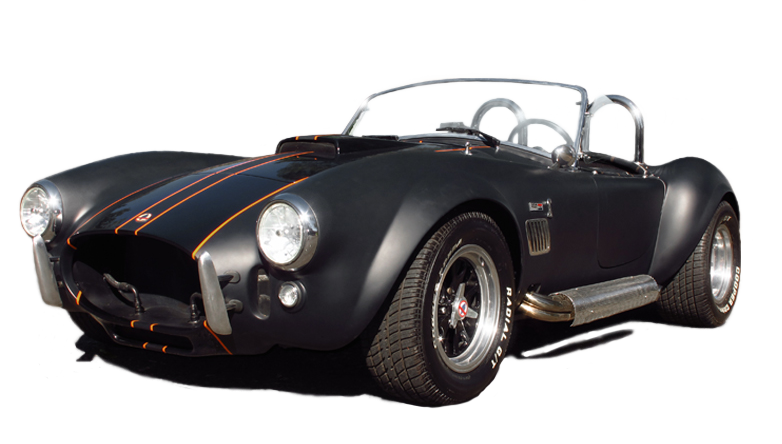
The width and height of the screenshot is (782, 444). I want to click on light, so click(280, 237).